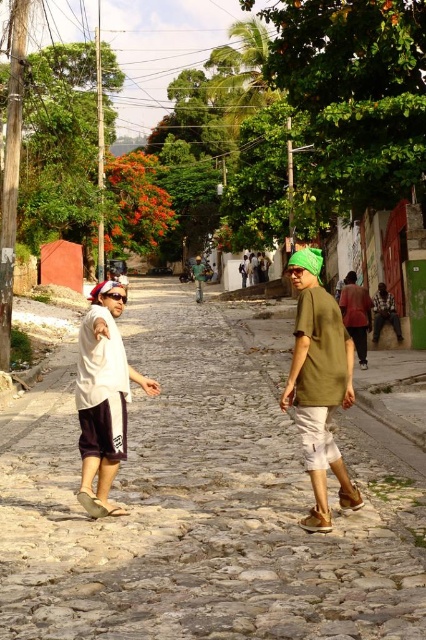
Which is more to the right, white matte shirt at left or green matte shirt at center?

white matte shirt at left

Measure the distance between white matte shirt at left and green matte shirt at center.

white matte shirt at left is 108.81 feet from green matte shirt at center.

What do you see at coordinates (103, 396) in the screenshot?
I see `white matte shirt at left` at bounding box center [103, 396].

Locate an element on the screen. white matte shirt at left is located at coordinates click(x=103, y=396).

Between matte green shirt at right and matte green shirt at center, which one has more height?

Standing taller between the two is matte green shirt at center.

This screenshot has height=640, width=426. Identify the location of matte green shirt at right. (365, 314).

Who is more forward, (397, 316) or (261, 257)?

Positioned in front is point (397, 316).

Find the location of a particular element. This screenshot has height=640, width=426. matte green shirt at right is located at coordinates (365, 314).

Between point (348, 305) and point (198, 298), which one is positioned behind?

The point (198, 298) is more distant.

Is the position of matte green shirt at right more distant than that of green matte shirt at center?

That is False.

Between point (365, 369) and point (193, 282), which one is positioned behind?

Point (193, 282)

Where is `matte green shirt at right`? Image resolution: width=426 pixels, height=640 pixels. matte green shirt at right is located at coordinates (365, 314).